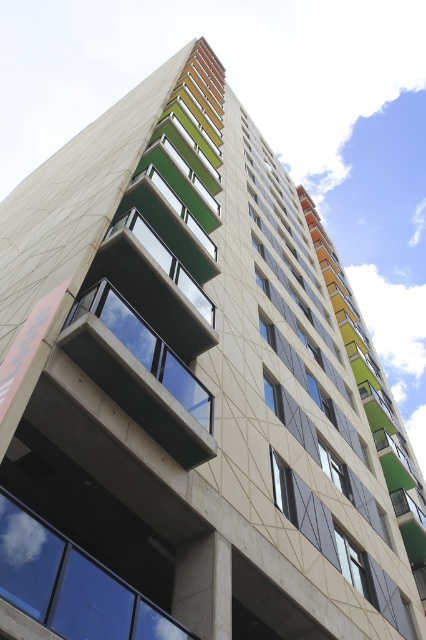
Question: Among these objects, which one is nearest to the camera?

Choices:
 (A) transparent glass window at center
 (B) clear glass window at center

Answer: (A)

Question: Among these points, which one is nearest to the camera?

Choices:
 (A) pyautogui.click(x=359, y=586)
 (B) pyautogui.click(x=19, y=506)

Answer: (B)

Question: Which object is the farthest from the clear glass window at center?

Choices:
 (A) transparent glass window at center
 (B) transparent glass balcony at center

Answer: (A)

Question: Does transparent glass balcony at center have a greater width compared to clear glass window at center?

Choices:
 (A) yes
 (B) no

Answer: (A)

Question: Does transparent glass balcony at center lie in front of clear glass window at center?

Choices:
 (A) yes
 (B) no

Answer: (A)

Question: Can you confirm if transparent glass window at center is positioned to the left of transparent glass balcony at center?

Choices:
 (A) no
 (B) yes

Answer: (B)